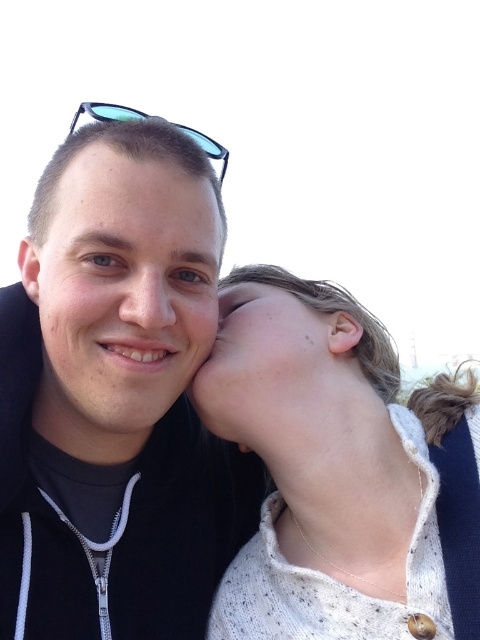
Question: Which object is closer to the camera taking this photo?

Choices:
 (A) matte black face at center
 (B) black matte jacket at center
 (C) knitted sweater at center
 (D) matte skin forehead at center

Answer: (B)

Question: Is matte skin forehead at center above black plastic sunglasses at upper center?

Choices:
 (A) no
 (B) yes

Answer: (A)

Question: Which point is closer to the camera taking this photo?

Choices:
 (A) (179, 124)
 (B) (60, 294)
 (C) (184, 188)

Answer: (B)

Question: Is the position of knitted sweater at center more distant than that of matte skin forehead at center?

Choices:
 (A) yes
 (B) no

Answer: (A)

Question: Which point is farther to the camera?

Choices:
 (A) (148, 204)
 (B) (29, 340)
 (C) (153, 291)
 (D) (199, 145)

Answer: (D)

Question: Does matte black face at center appear over matte skin forehead at center?

Choices:
 (A) yes
 (B) no

Answer: (B)